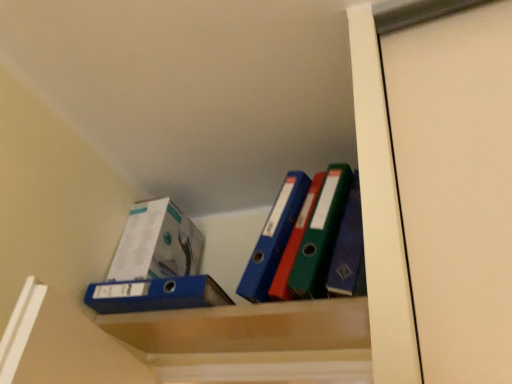
The width and height of the screenshot is (512, 384). What do you see at coordinates (246, 327) in the screenshot? I see `matte plastic cabinet at center` at bounding box center [246, 327].

Describe the element at coordinates (156, 243) in the screenshot. I see `white glossy box at upper left` at that location.

Looking at this image, in order to face white glossy box at upper left, should I rotate leftwards or rightwards?

To align with it, rotate left about 12.382°.

At what (x,y) coordinates should I click in order to perform the action: click on blue matte folder at center. Please return your answer as a coordinate pair (x, y). Looking at the image, I should click on coord(155,295).

Is matte plastic cabinet at center bigger or smaller than white glossy box at upper left?

Considering their sizes, matte plastic cabinet at center takes up less space than white glossy box at upper left.

Which is more to the right, matte plastic cabinet at center or white glossy box at upper left?

Positioned to the right is matte plastic cabinet at center.

Does point (249, 337) lie behind point (141, 223)?

No, it is in front of (141, 223).

How different are the orientations of blue matte folder at center and white glossy box at upper left in degrees?

blue matte folder at center and white glossy box at upper left are facing 0.083 degrees away from each other.

From a real-world perspective, is blue matte folder at center physically above white glossy box at upper left?

Actually, blue matte folder at center is physically below white glossy box at upper left in the real world.

Does point (122, 291) lie in front of point (128, 269)?

Yes, point (122, 291) is closer to viewer.

I want to click on paperback book beneath the white glossy box at upper left (from a real-world perspective), so click(155, 295).

Considering the relative sizes of white glossy box at upper left and blue matte folder at center in the image provided, is white glossy box at upper left thinner than blue matte folder at center?

Yes.

From a real-world perspective, is white glossy box at upper left located beneath blue matte folder at center?

No, from a real-world perspective, white glossy box at upper left is not under blue matte folder at center.

In the image, is blue matte folder at center on the left side or the right side of matte plastic cabinet at center?

From the image, it's evident that blue matte folder at center is to the left of matte plastic cabinet at center.

Which object is more forward, blue matte folder at center or matte plastic cabinet at center?

matte plastic cabinet at center is in front.

Is blue matte folder at center wider than matte plastic cabinet at center?

Yes.

Where is `box located above the matte plastic cabinet at center (from a real-world perspective)`? box located above the matte plastic cabinet at center (from a real-world perspective) is located at coordinates (156, 243).

Is white glossy box at upper left to the left or to the right of matte plastic cabinet at center in the image?

In the image, white glossy box at upper left appears on the left side of matte plastic cabinet at center.

Is point (189, 252) less distant than point (161, 351)?

No, it is not.

Considering the sizes of white glossy box at upper left and matte plastic cabinet at center in the image, is white glossy box at upper left bigger or smaller than matte plastic cabinet at center?

Considering their sizes, white glossy box at upper left takes up more space than matte plastic cabinet at center.

The image size is (512, 384). I want to click on cabinet in front of the blue matte folder at center, so click(246, 327).

Is matte plastic cabinet at center directly adjacent to blue matte folder at center?

There is a gap between matte plastic cabinet at center and blue matte folder at center.

Which object is further away from the camera, matte plastic cabinet at center or blue matte folder at center?

blue matte folder at center.

Who is taller, matte plastic cabinet at center or blue matte folder at center?

blue matte folder at center.

Where is `cabinet below the white glossy box at upper left (from a real-world perspective)`? cabinet below the white glossy box at upper left (from a real-world perspective) is located at coordinates (246, 327).

Find the location of a particular element. The image size is (512, 384). box above the blue matte folder at center (from a real-world perspective) is located at coordinates (156, 243).

Looking at the image, which one is located further to matte plastic cabinet at center, white glossy box at upper left or blue matte folder at center?

white glossy box at upper left is further to matte plastic cabinet at center.

Consider the image. Looking at the image, which one is located closer to matte plastic cabinet at center, blue matte folder at center or white glossy box at upper left?

The object closer to matte plastic cabinet at center is blue matte folder at center.

From the image, which object appears to be farther from white glossy box at upper left, matte plastic cabinet at center or blue matte folder at center?

Based on the image, matte plastic cabinet at center appears to be further to white glossy box at upper left.

Looking at the image, which one is located further to blue matte folder at center, white glossy box at upper left or matte plastic cabinet at center?

white glossy box at upper left.

Considering their positions, is matte plastic cabinet at center positioned further to blue matte folder at center than white glossy box at upper left?

Among the two, white glossy box at upper left is located further to blue matte folder at center.

When comparing their distances from white glossy box at upper left, does blue matte folder at center or matte plastic cabinet at center seem further?

matte plastic cabinet at center is positioned further to the anchor white glossy box at upper left.

Image resolution: width=512 pixels, height=384 pixels. What are the coordinates of `paperback book located between matte plastic cabinet at center and white glossy box at upper left in the depth direction` in the screenshot? It's located at (155, 295).